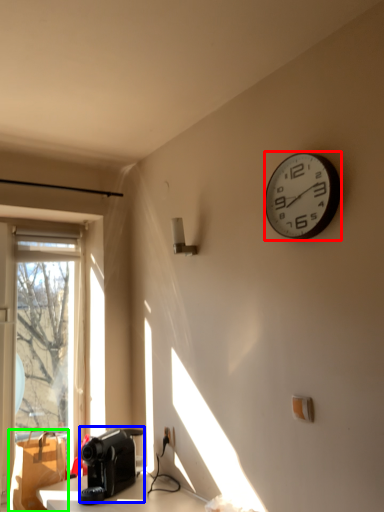
Question: Based on their relative distances, which object is nearer to wall clock (highlighted by a red box)? Choose from appliance (highlighted by a blue box) and cardboard box (highlighted by a green box).

Choices:
 (A) appliance
 (B) cardboard box

Answer: (A)